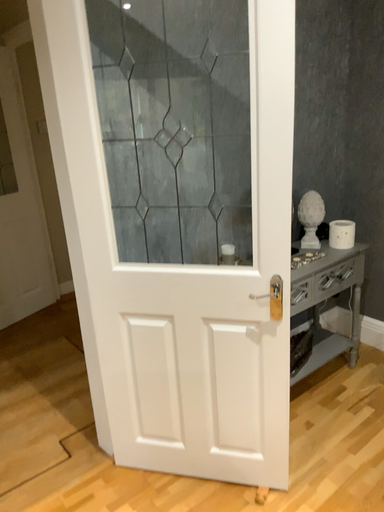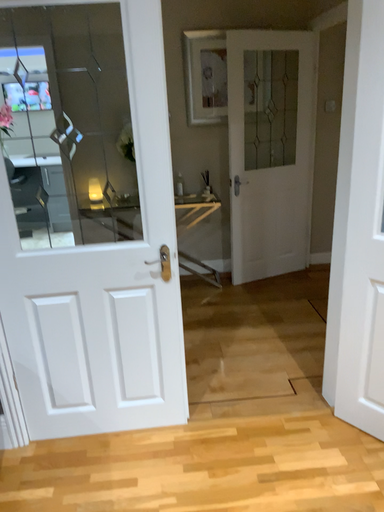
Question: Which way did the camera rotate in the video?

Choices:
 (A) rotated right
 (B) rotated left

Answer: (B)